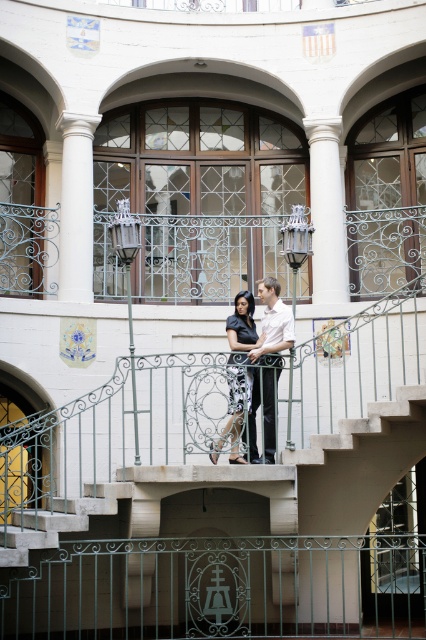
Between green wrought iron railing at center and white glossy shirt at center, which one appears on the right side from the viewer's perspective?

green wrought iron railing at center

Who is lower down, green wrought iron railing at center or white glossy shirt at center?

green wrought iron railing at center

Measure the distance between green wrought iron railing at center and camera.

They are 42.48 meters apart.

Image resolution: width=426 pixels, height=640 pixels. In order to click on green wrought iron railing at center in this screenshot , I will do `click(218, 588)`.

Who is positioned more to the right, green wrought iron railing at center or matte black dress at center?

green wrought iron railing at center is more to the right.

Does green wrought iron railing at center have a lesser width compared to matte black dress at center?

Incorrect, green wrought iron railing at center's width is not less than matte black dress at center's.

Where is `green wrought iron railing at center`? The width and height of the screenshot is (426, 640). green wrought iron railing at center is located at coordinates (218, 588).

Is white glossy shirt at center positioned behind matte black dress at center?

That is True.

The height and width of the screenshot is (640, 426). Find the location of `white glossy shirt at center`. white glossy shirt at center is located at coordinates (268, 364).